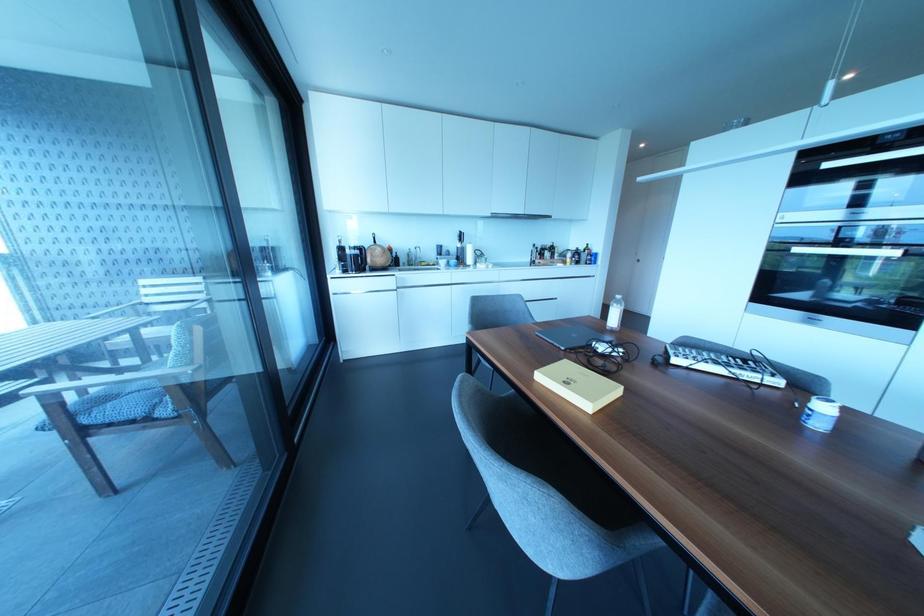
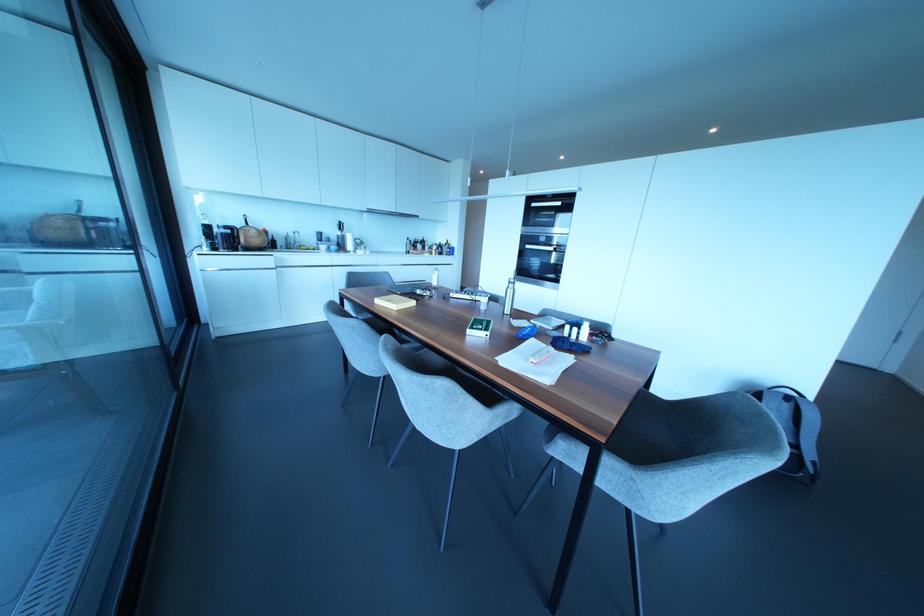
Locate, in the second image, the point that corresponds to (493,215) in the first image.

(370, 209)